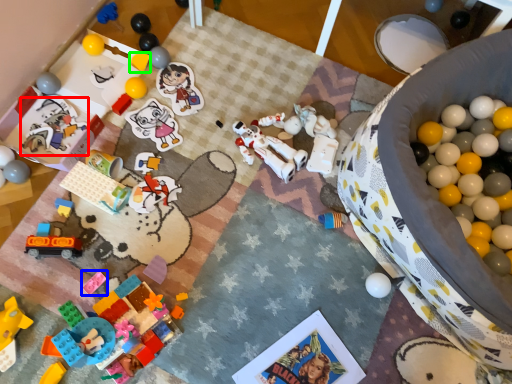
Question: Considering the real-world distances, which object is farthest from toy (highlighted by a red box)? toy (highlighted by a blue box) or toy (highlighted by a green box)?

Choices:
 (A) toy
 (B) toy

Answer: (A)